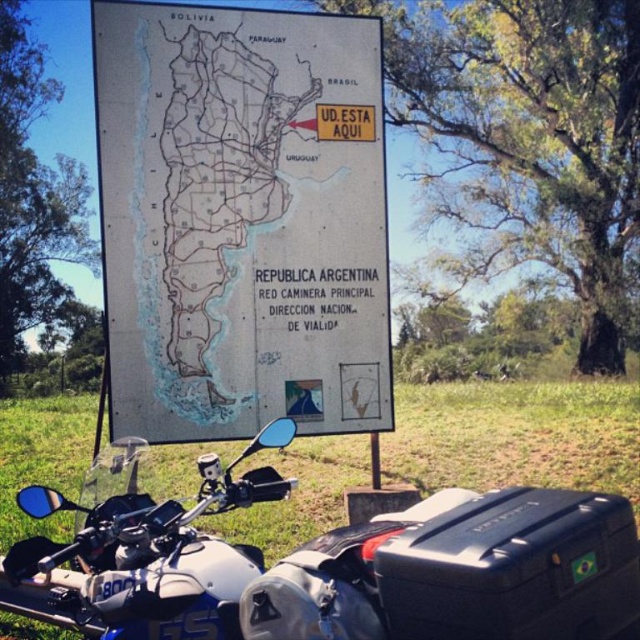
You are standing in front of a large map signboard in Argentina. There is a point marked at coordinates (241, 220) on the gray paper map at center. What does this point indicate?

The point at coordinates (241, 220) on the gray paper map at center marks the location where you are currently standing, as indicated by the yellow arrow pointing to the location marked UD. ESTA AQUI.

You are standing in front of the gray paper map at center and want to take a photo of the silver metallic motorcycle at lower left. Can you see the motorcycle clearly without moving your position?

The silver metallic motorcycle at lower left is behind the gray paper map at center, so you cannot see it clearly from your current position in front of the gray paper map at center.